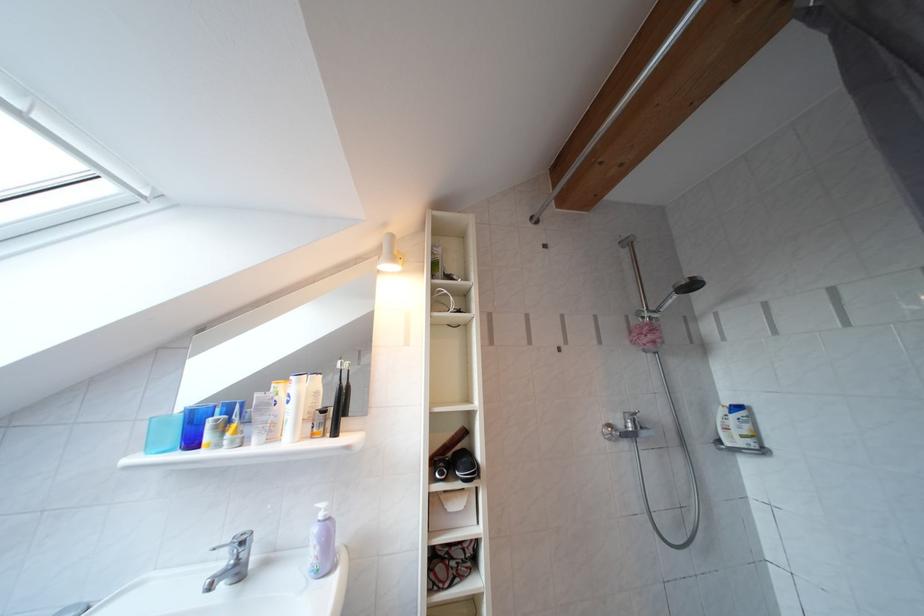
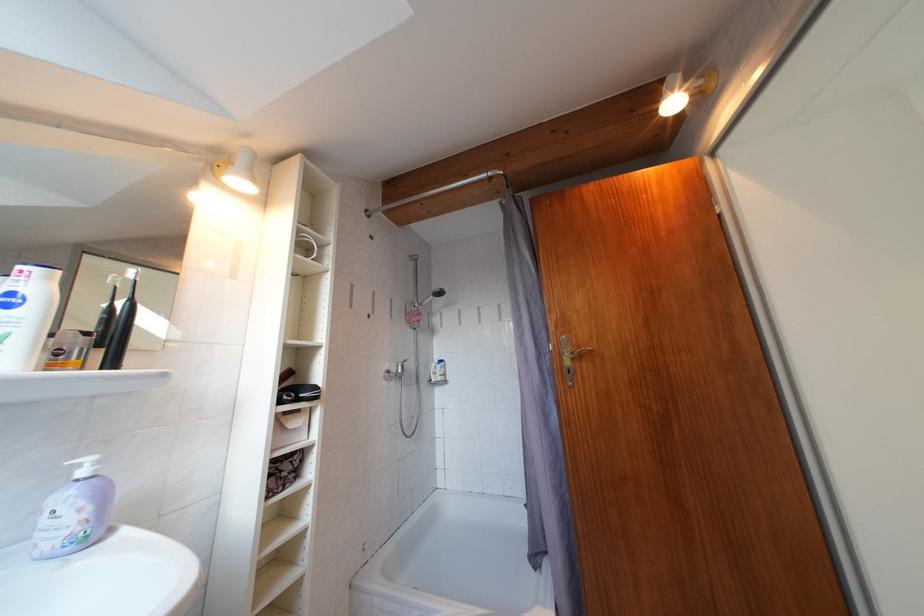
In the second image, find the point that corresponds to (330,521) in the first image.

(92, 477)